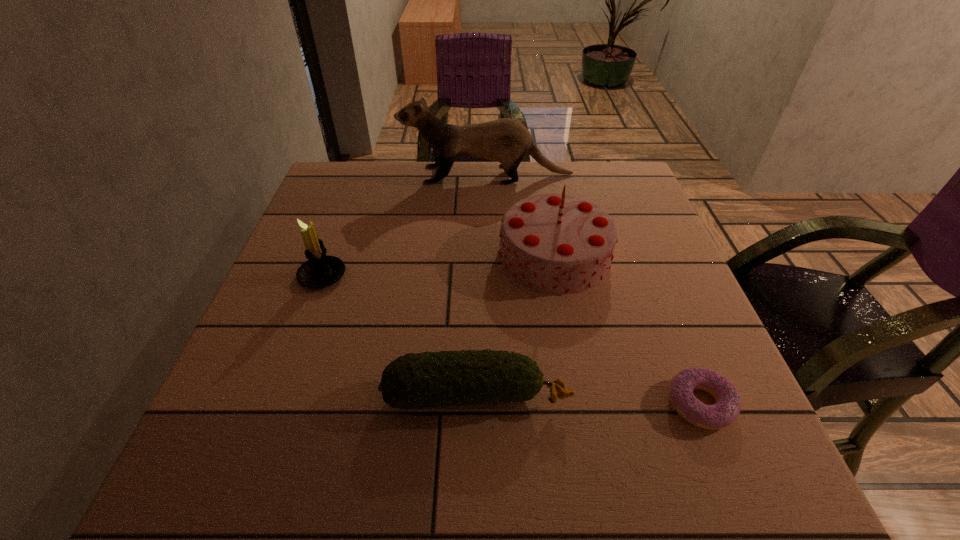
The width and height of the screenshot is (960, 540). Find the location of `free point that satisfies the following two spatial constraints: 1. at the blossom end of the rightmost object; 2. on the right side of the fourth tallest object`. free point that satisfies the following two spatial constraints: 1. at the blossom end of the rightmost object; 2. on the right side of the fourth tallest object is located at coordinates (476, 404).

Locate an element on the screen. The width and height of the screenshot is (960, 540). vacant space that satisfies the following two spatial constraints: 1. at the blossom end of the rightmost object; 2. on the right side of the fourth tallest object is located at coordinates (476, 404).

Image resolution: width=960 pixels, height=540 pixels. I want to click on free space that satisfies the following two spatial constraints: 1. on the face of the farthest object; 2. on the back side of the rightmost object, so click(492, 404).